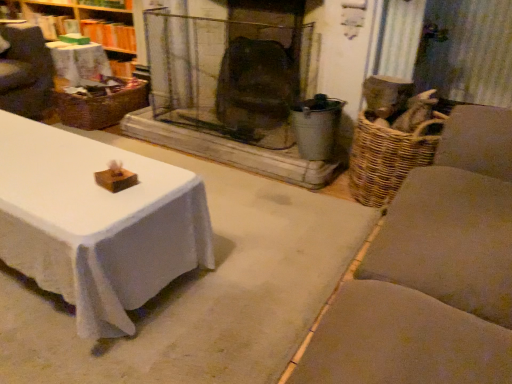
Question: Considering the positions of wooden wicker basket at upper left and woven brown basket at left in the image, is wooden wicker basket at upper left taller or shorter than woven brown basket at left?

Choices:
 (A) short
 (B) tall

Answer: (B)

Question: Does point (113, 11) appear closer or farther from the camera than point (126, 100)?

Choices:
 (A) closer
 (B) farther

Answer: (B)

Question: Considering the relative positions of wooden wicker basket at upper left and woven brown basket at left in the image provided, is wooden wicker basket at upper left to the left or to the right of woven brown basket at left?

Choices:
 (A) right
 (B) left

Answer: (B)

Question: In the image, is woven brown basket at left positioned in front of or behind wooden wicker basket at upper left?

Choices:
 (A) front
 (B) behind

Answer: (A)

Question: Is woven brown basket at left spatially inside wooden wicker basket at upper left, or outside of it?

Choices:
 (A) outside
 (B) inside

Answer: (A)

Question: Does point (81, 107) appear closer or farther from the camera than point (117, 34)?

Choices:
 (A) closer
 (B) farther

Answer: (A)

Question: Looking at the image, does woven brown basket at left seem bigger or smaller compared to wooden wicker basket at upper left?

Choices:
 (A) small
 (B) big

Answer: (A)